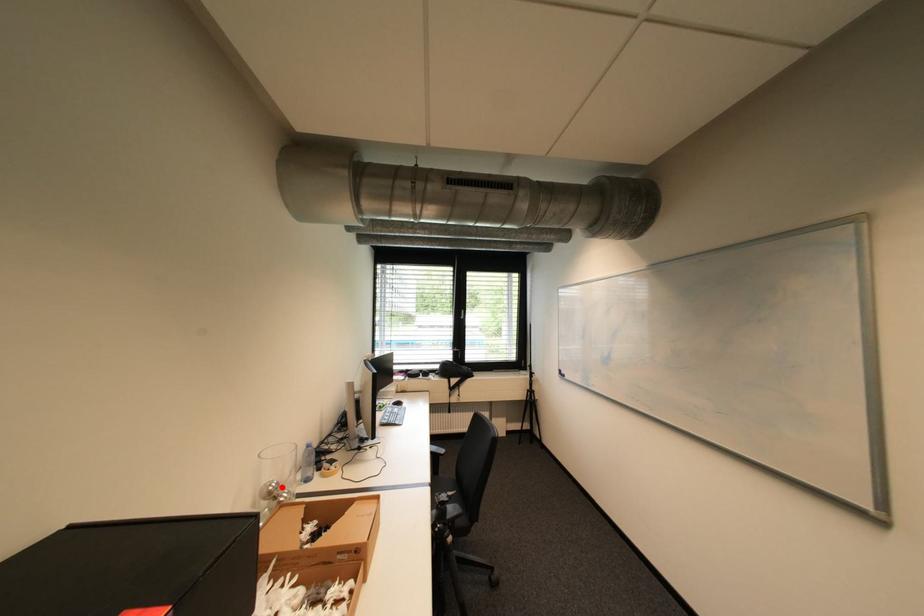
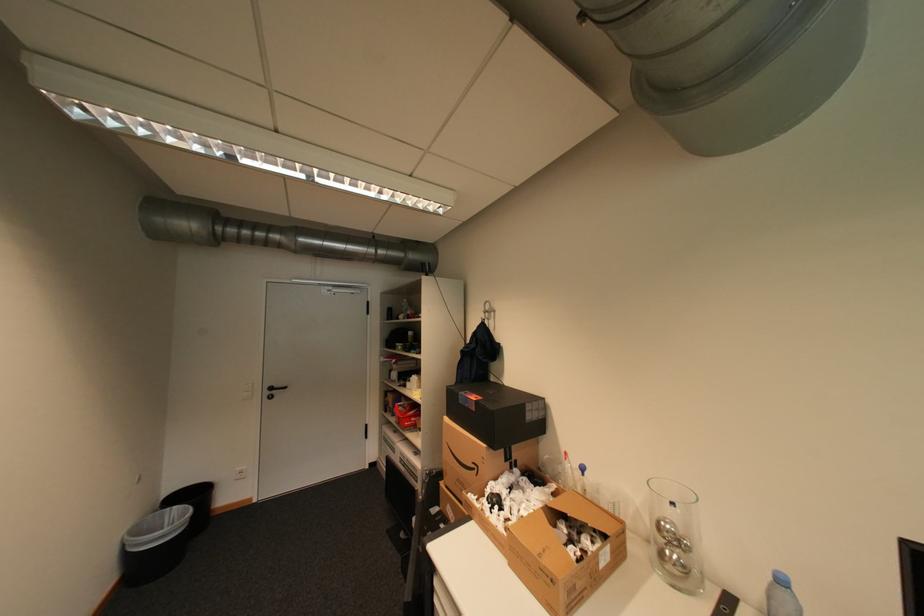
The point at the highlighted location is marked in the first image. Where is the corresponding point in the second image?

(673, 527)